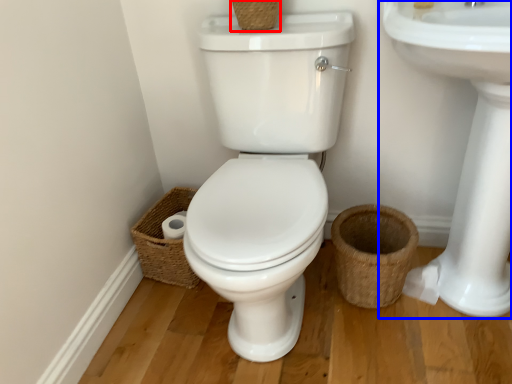
Question: Which of the following is the farthest to the observer, basket (highlighted by a red box) or sink (highlighted by a blue box)?

Choices:
 (A) basket
 (B) sink

Answer: (A)